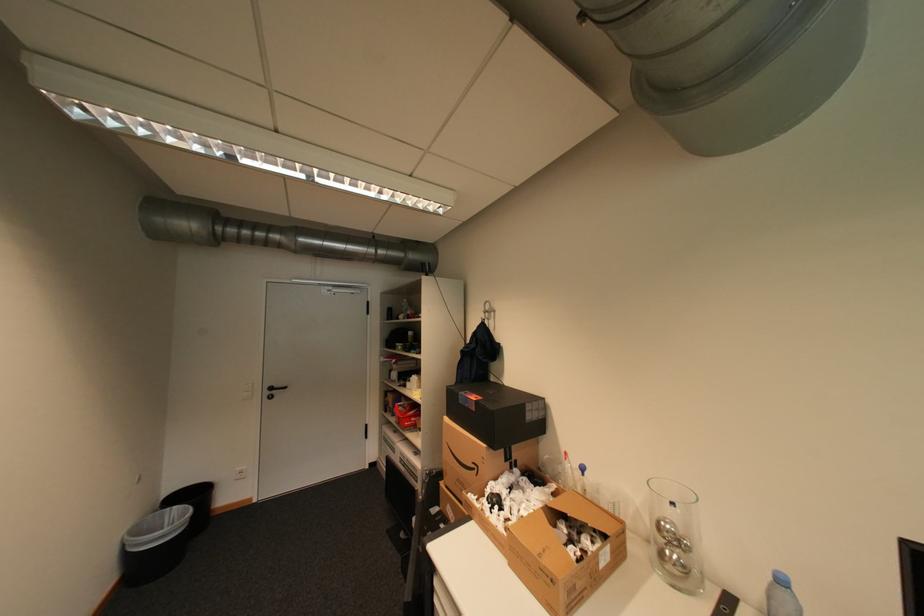
Identify the location of cardboard box. The image size is (924, 616). (533, 523).